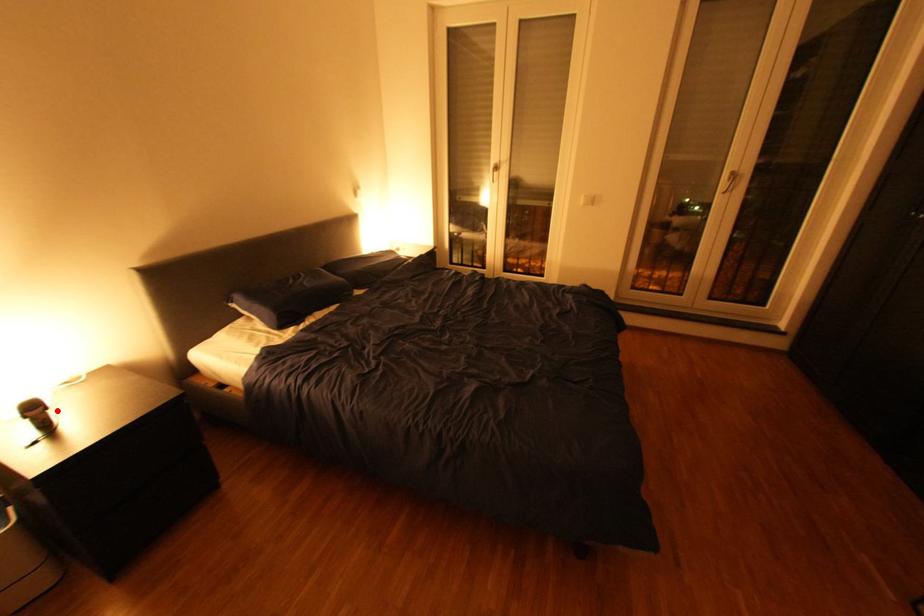
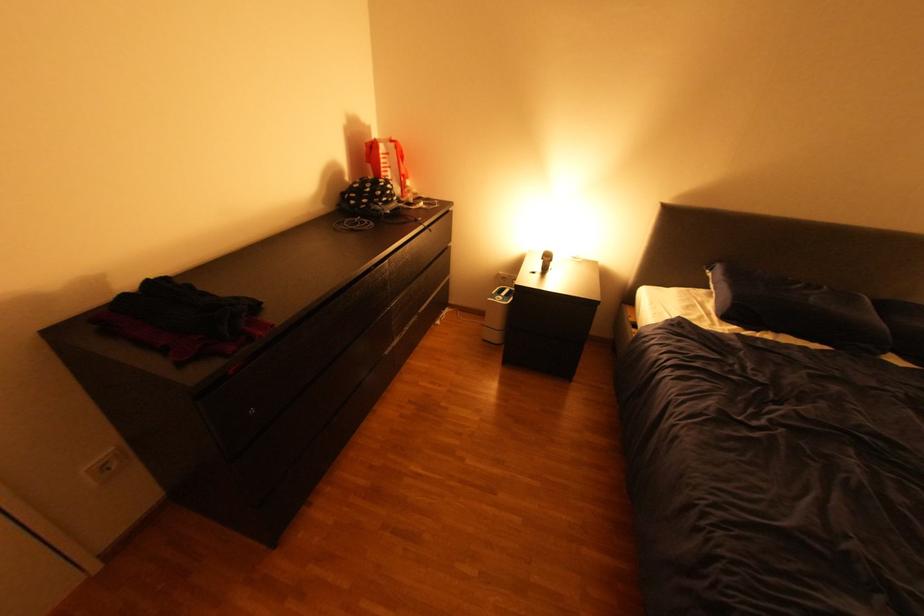
Question: I am providing you with two images of the same scene from different viewpoints. A red point is shown in image1. For the corresponding object point in image2, is it positioned nearer or farther from the camera?

Choices:
 (A) Nearer
 (B) Farther

Answer: (B)